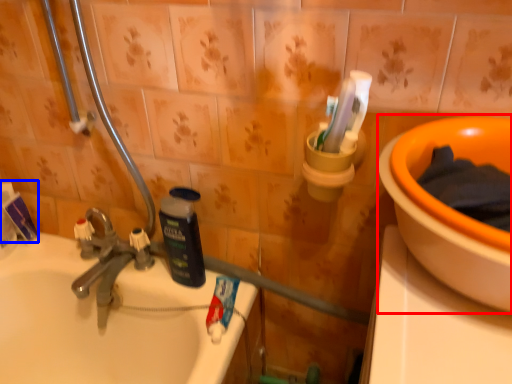
Question: Which object is further to the camera taking this photo, basin (highlighted by a red box) or toothpaste (highlighted by a blue box)?

Choices:
 (A) basin
 (B) toothpaste

Answer: (B)